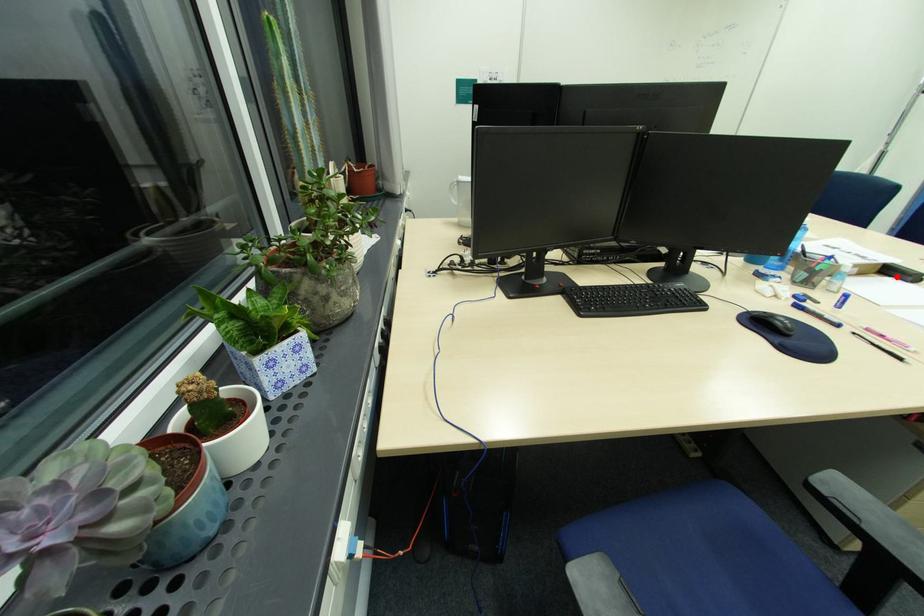
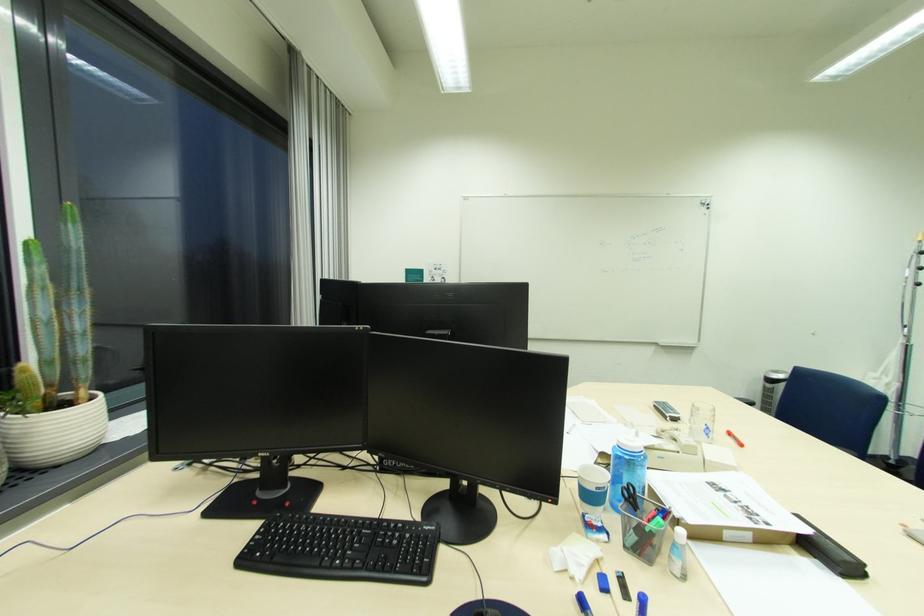
Where in the second image is the point corresponding to the highlighted location from the first image?

(821, 557)